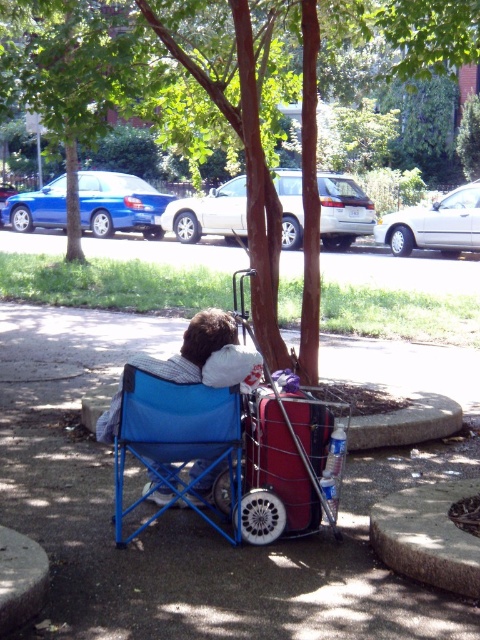
You are a park visitor who wants to take a photo of the green leafy tree at center and the blue fabric chair at center. Which object should you focus on first if you want to capture both in a single frame without moving the camera?

You should focus on the blue fabric chair at center first because it is shorter than the green leafy tree at center, allowing both to fit within the frame when positioned properly.

You are a photographer setting up a shot in the park. You have a camera that can only capture objects within a 1.5 meter width. You want to include both the green leafy tree at center and the blue fabric chair at center in your photo. Based on their widths, will both fit within the camera frame?

The green leafy tree at center might be wider than blue fabric chair at center. Since the camera can only capture 1.5 meters width, if the tree is wider than 1.5 meters, it won me be possible. However, if the tree is narrower, both could fit. The exact width isn